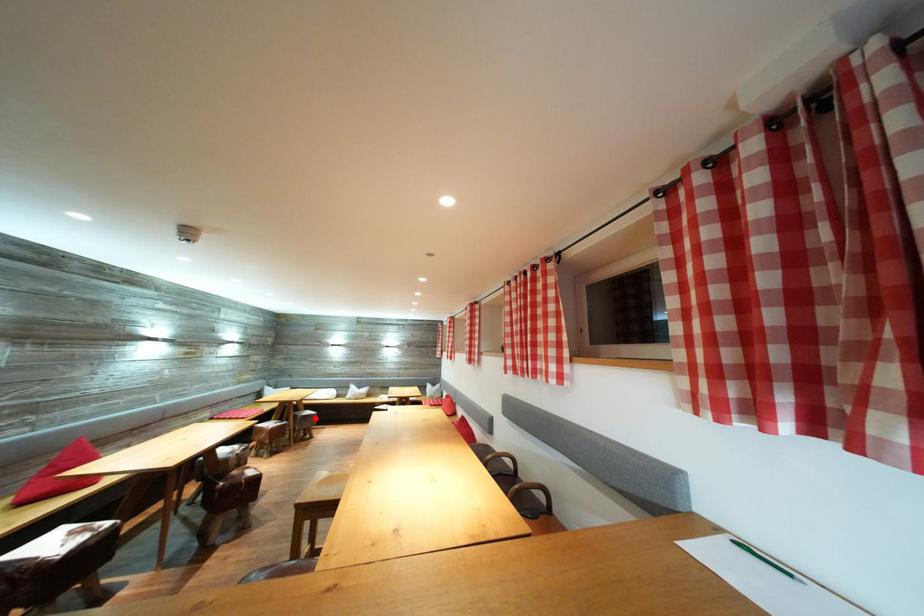
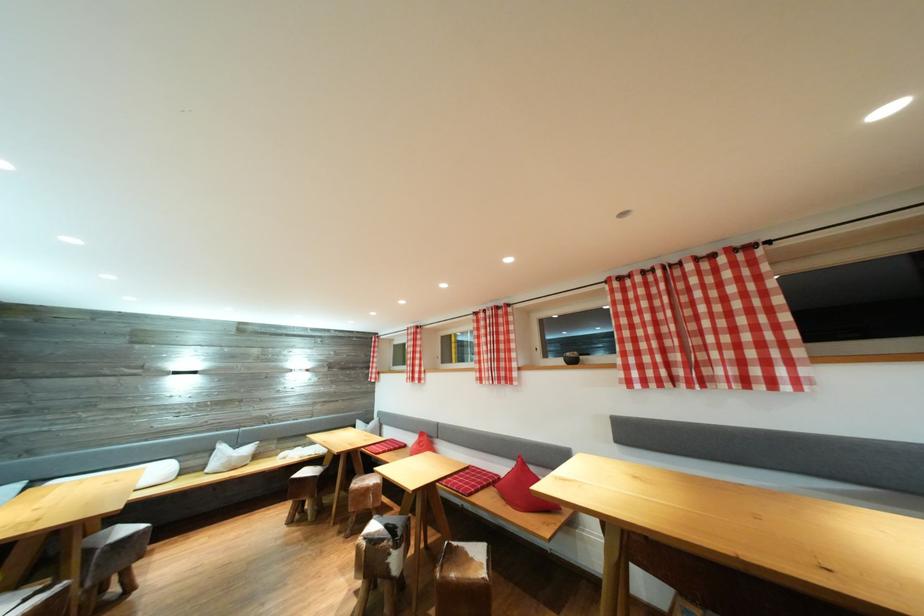
Question: I am providing you with two images of the same scene from different viewpoints. Image1 has a red point marked. In image2, the corresponding 3D location appears at what relative position? Reply with the corresponding letter.

Choices:
 (A) Closer
 (B) Farther

Answer: (A)